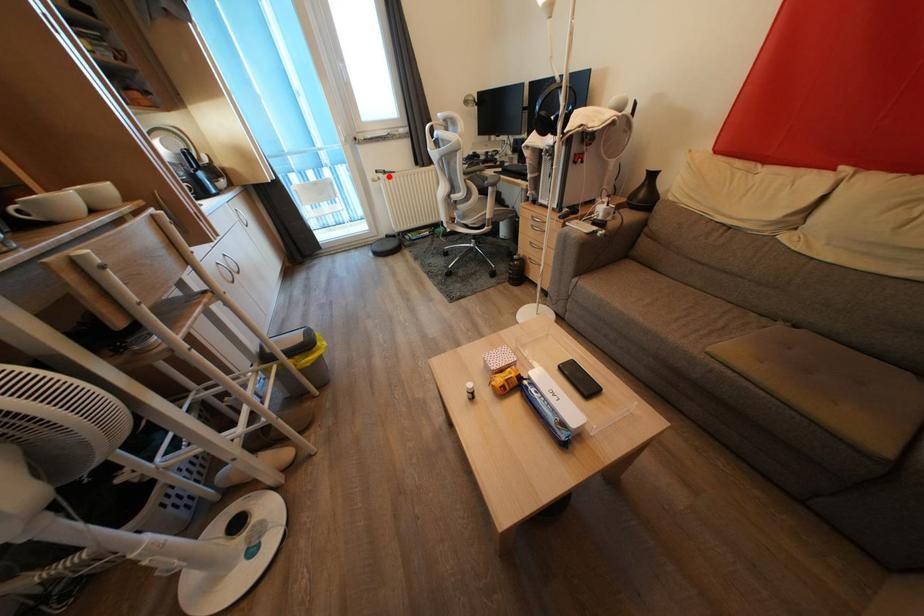
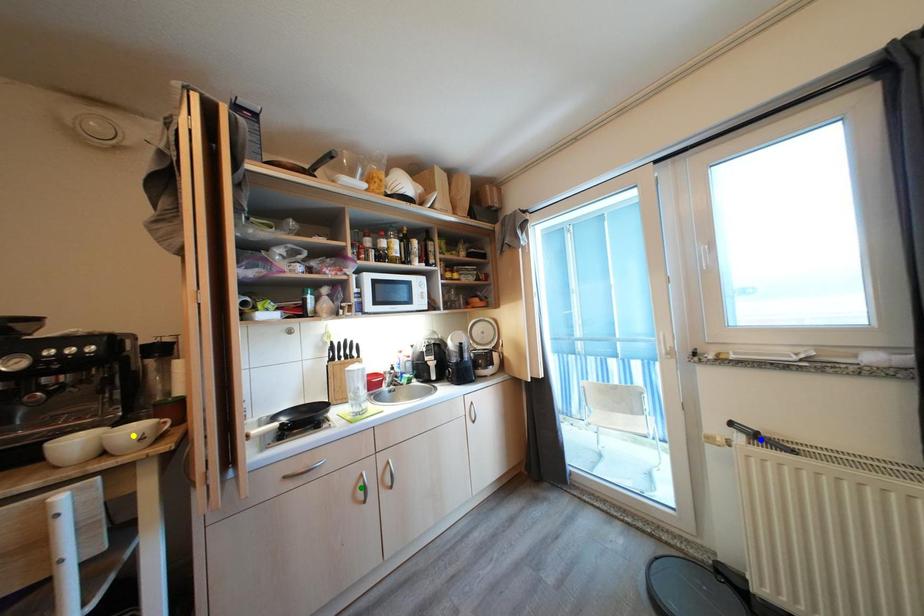
Question: I am providing you with two images of the same scene from different viewpoints. A red point is marked on the first image. You are given multiple points on the second image. Which spot in image 2 lines up with the point in image 1?

Choices:
 (A) blue point
 (B) yellow point
 (C) green point

Answer: (A)